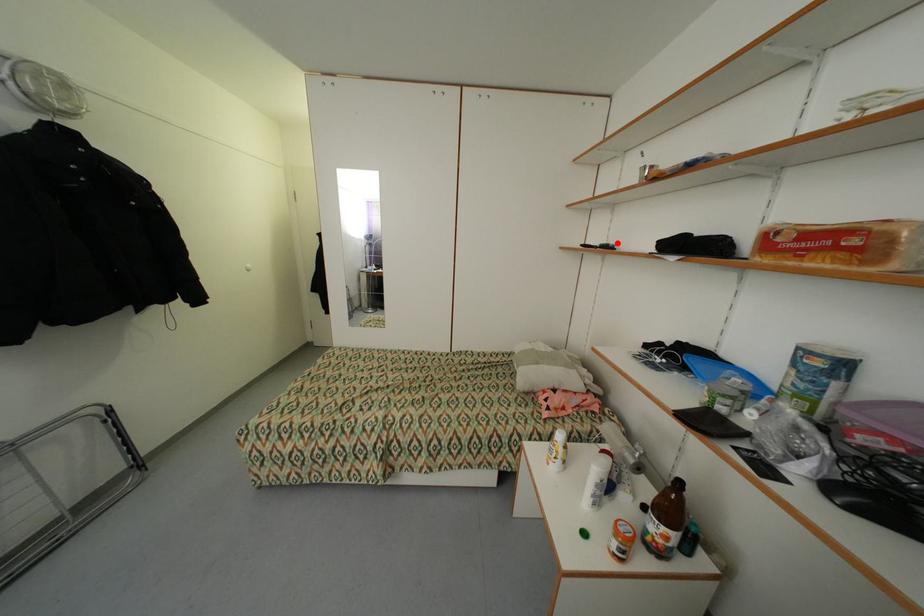
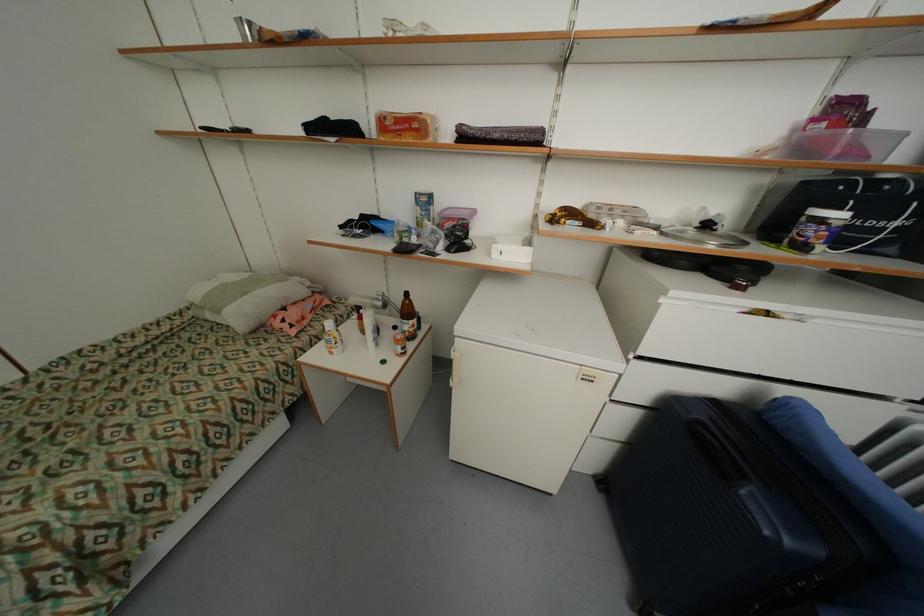
In the second image, find the point that corresponds to the highlighted location in the first image.

(248, 128)